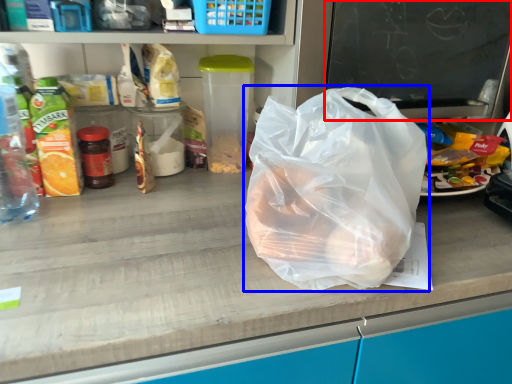
Question: Which object is closer to the camera taking this photo, writing (highlighted by a red box) or plastic bag (highlighted by a blue box)?

Choices:
 (A) writing
 (B) plastic bag

Answer: (B)